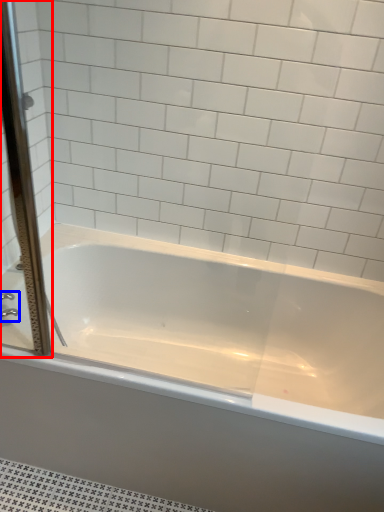
Question: Which object is further to the camera taking this photo, screen door (highlighted by a red box) or faucet (highlighted by a blue box)?

Choices:
 (A) screen door
 (B) faucet

Answer: (B)